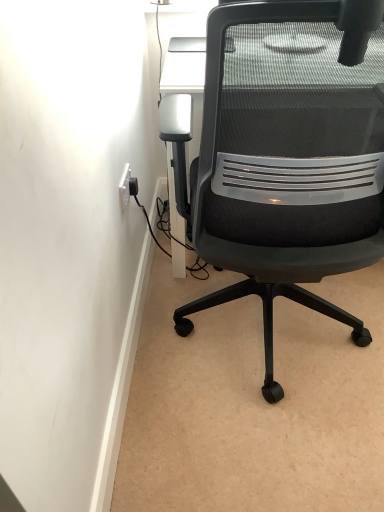
Where is `white plastic electric outlet at upper left`? The width and height of the screenshot is (384, 512). white plastic electric outlet at upper left is located at coordinates (125, 188).

The image size is (384, 512). What do you see at coordinates (125, 188) in the screenshot? I see `white plastic electric outlet at upper left` at bounding box center [125, 188].

Measure the distance between white plastic electric outlet at upper left and camera.

They are 1.16 meters apart.

Describe the element at coordinates (290, 155) in the screenshot. I see `black mesh office chair at center` at that location.

This screenshot has height=512, width=384. Find the location of `black mesh office chair at center`. black mesh office chair at center is located at coordinates (290, 155).

The image size is (384, 512). I want to click on white plastic electric outlet at upper left, so click(125, 188).

Which is more to the left, black mesh office chair at center or white plastic electric outlet at upper left?

white plastic electric outlet at upper left.

Between black mesh office chair at center and white plastic electric outlet at upper left, which one is positioned behind?

white plastic electric outlet at upper left is further from the camera.

Considering the positions of points (327, 314) and (121, 211), is point (327, 314) farther from camera compared to point (121, 211)?

Yes, it is behind point (121, 211).

From the image's perspective, which one is positioned higher, black mesh office chair at center or white plastic electric outlet at upper left?

white plastic electric outlet at upper left appears higher in the image.

From a real-world perspective, does black mesh office chair at center stand above white plastic electric outlet at upper left?

Yes, from a real-world perspective, black mesh office chair at center is above white plastic electric outlet at upper left.

Which of these two, black mesh office chair at center or white plastic electric outlet at upper left, is wider?

black mesh office chair at center.

Is black mesh office chair at center taller or shorter than white plastic electric outlet at upper left?

black mesh office chair at center is taller than white plastic electric outlet at upper left.

Looking at the image, does black mesh office chair at center seem bigger or smaller compared to white plastic electric outlet at upper left?

Clearly, black mesh office chair at center is larger in size than white plastic electric outlet at upper left.

Is black mesh office chair at center not inside white plastic electric outlet at upper left?

Indeed, black mesh office chair at center is completely outside white plastic electric outlet at upper left.

Is black mesh office chair at center next to white plastic electric outlet at upper left and touching it?

black mesh office chair at center and white plastic electric outlet at upper left are not in contact.

Is black mesh office chair at center looking in the opposite direction of white plastic electric outlet at upper left?

No, black mesh office chair at center is not facing the opposite direction of white plastic electric outlet at upper left.

What's the angular difference between black mesh office chair at center and white plastic electric outlet at upper left's facing directions?

92.9 degrees.

Where is `chair above the white plastic electric outlet at upper left (from a real-world perspective)`? Image resolution: width=384 pixels, height=512 pixels. chair above the white plastic electric outlet at upper left (from a real-world perspective) is located at coordinates (290, 155).

Considering the relative positions of white plastic electric outlet at upper left and black mesh office chair at center in the image provided, is white plastic electric outlet at upper left to the left or to the right of black mesh office chair at center?

Based on their positions, white plastic electric outlet at upper left is located to the left of black mesh office chair at center.

Is white plastic electric outlet at upper left behind black mesh office chair at center?

Yes, white plastic electric outlet at upper left is behind black mesh office chair at center.

Consider the image. Which point is more forward, [121,181] or [255,39]?

The point [255,39] is in front.

From the image's perspective, is white plastic electric outlet at upper left beneath black mesh office chair at center?

Incorrect, from the image's perspective, white plastic electric outlet at upper left is higher than black mesh office chair at center.

From a real-world perspective, relative to black mesh office chair at center, is white plastic electric outlet at upper left vertically above or below?

white plastic electric outlet at upper left is situated lower than black mesh office chair at center in the real world.

Considering the sizes of objects white plastic electric outlet at upper left and black mesh office chair at center in the image provided, who is thinner, white plastic electric outlet at upper left or black mesh office chair at center?

white plastic electric outlet at upper left.

In the scene shown: Is white plastic electric outlet at upper left shorter than black mesh office chair at center?

Indeed, white plastic electric outlet at upper left has a lesser height compared to black mesh office chair at center.

Does white plastic electric outlet at upper left have a larger size compared to black mesh office chair at center?

No, white plastic electric outlet at upper left is not bigger than black mesh office chair at center.

Is white plastic electric outlet at upper left outside of black mesh office chair at center?

white plastic electric outlet at upper left lies outside black mesh office chair at center's area.

Does white plastic electric outlet at upper left touch black mesh office chair at center?

white plastic electric outlet at upper left and black mesh office chair at center are clearly separated.

Is white plastic electric outlet at upper left positioned with its back to black mesh office chair at center?

No.

Locate an element on the screen. The height and width of the screenshot is (512, 384). electric outlet behind the black mesh office chair at center is located at coordinates (125, 188).

In order to click on chair below the white plastic electric outlet at upper left (from the image's perspective) in this screenshot , I will do [x=290, y=155].

This screenshot has height=512, width=384. In order to click on electric outlet on the left of the black mesh office chair at center in this screenshot , I will do `click(125, 188)`.